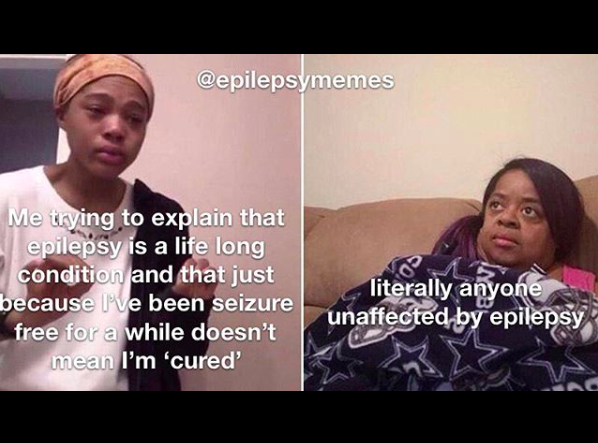
The height and width of the screenshot is (443, 598). Find the location of `blanket`. blanket is located at coordinates [499, 344].